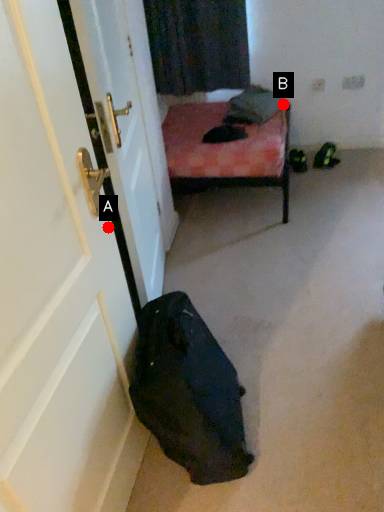
Question: Two points are circled on the image, labeled by A and B beside each circle. Among these points, which one is nearest to the camera?

Choices:
 (A) A is closer
 (B) B is closer

Answer: (A)